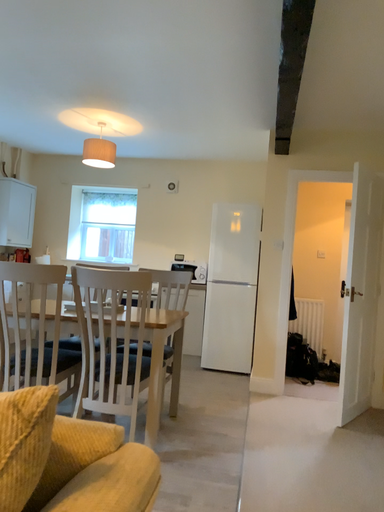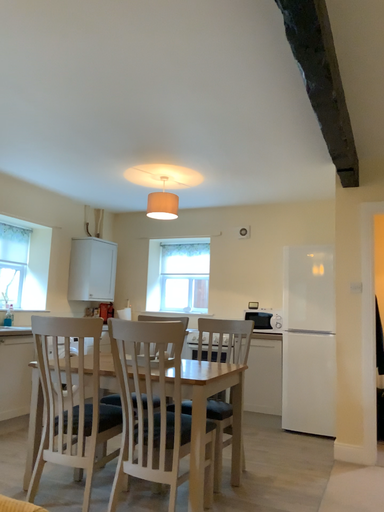
Question: How did the camera likely rotate when shooting the video?

Choices:
 (A) rotated upward
 (B) rotated downward

Answer: (A)